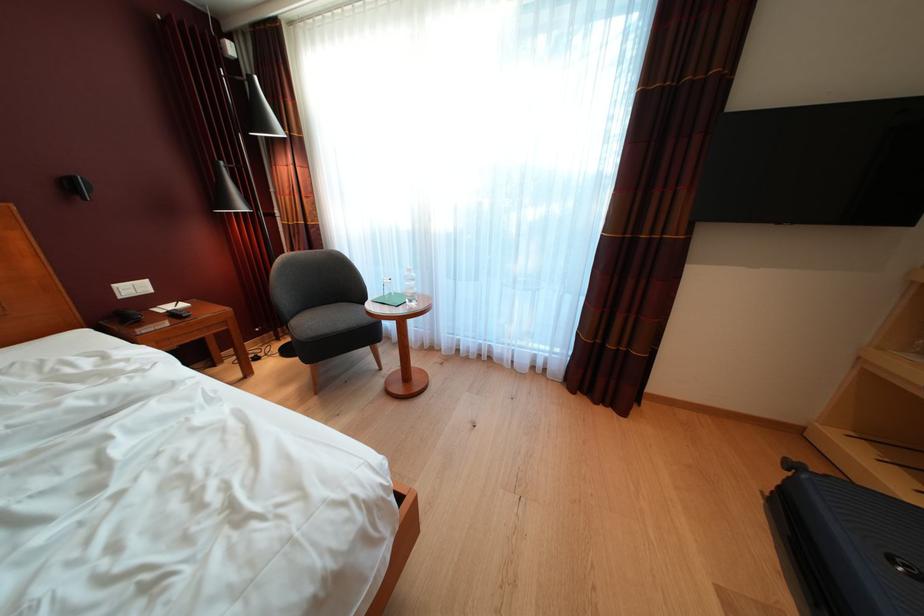
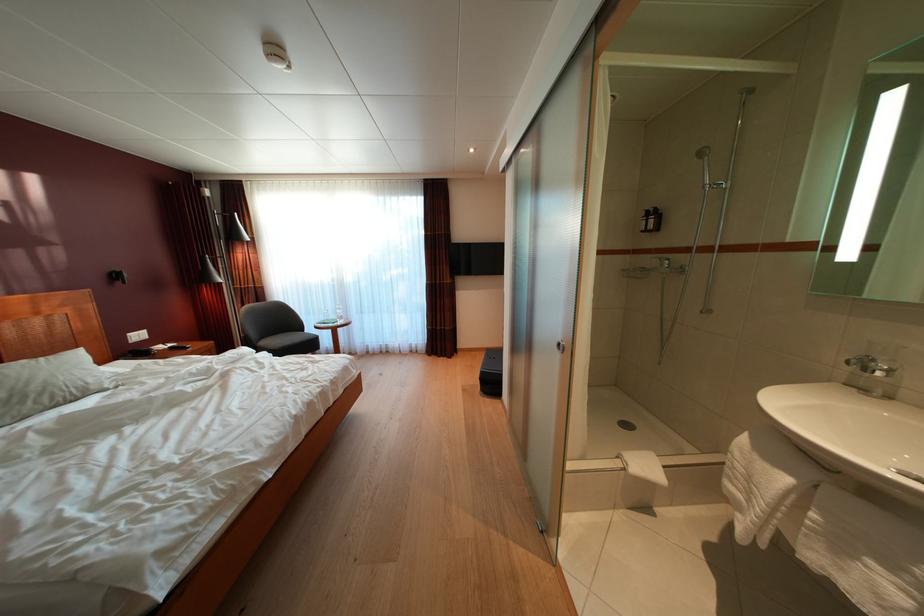
Question: In a continuous first-person perspective shot, in which direction is the camera moving?

Choices:
 (A) Left
 (B) Right
 (C) Forward
 (D) Backward

Answer: (D)